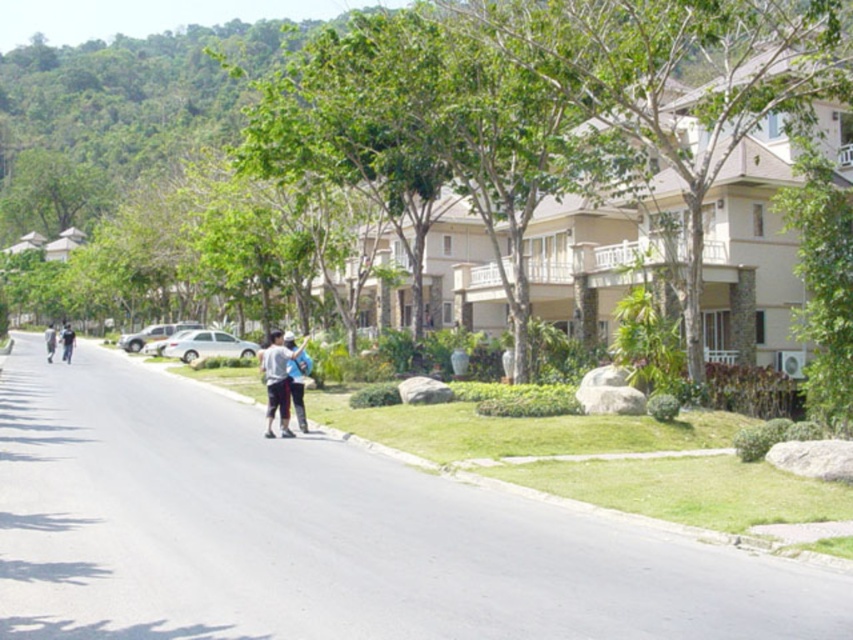
Which is behind, point (277, 362) or point (65, 324)?

The point (65, 324) is behind.

Is point (260, 371) in front of point (62, 324)?

Yes.

Does point (270, 426) come in front of point (62, 340)?

That is True.

This screenshot has width=853, height=640. What are the coordinates of `blue denim jeans at center` in the screenshot? It's located at (277, 380).

Does blue denim jeans at center come in front of light blue fabric shirt at center?

Yes, it is.

Is blue denim jeans at center bigger than light blue fabric shirt at center?

Incorrect, blue denim jeans at center is not larger than light blue fabric shirt at center.

Image resolution: width=853 pixels, height=640 pixels. What do you see at coordinates (277, 380) in the screenshot?
I see `blue denim jeans at center` at bounding box center [277, 380].

At what (x,y) coordinates should I click in order to perform the action: click on blue denim jeans at center. Please return your answer as a coordinate pair (x, y). The width and height of the screenshot is (853, 640). Looking at the image, I should click on (277, 380).

Does blue denim jeans at center appear under light gray fabric couple at center?

Correct, blue denim jeans at center is located below light gray fabric couple at center.

What do you see at coordinates (277, 380) in the screenshot?
I see `blue denim jeans at center` at bounding box center [277, 380].

At what (x,y) coordinates should I click in order to perform the action: click on blue denim jeans at center. Please return your answer as a coordinate pair (x, y). The height and width of the screenshot is (640, 853). Looking at the image, I should click on (277, 380).